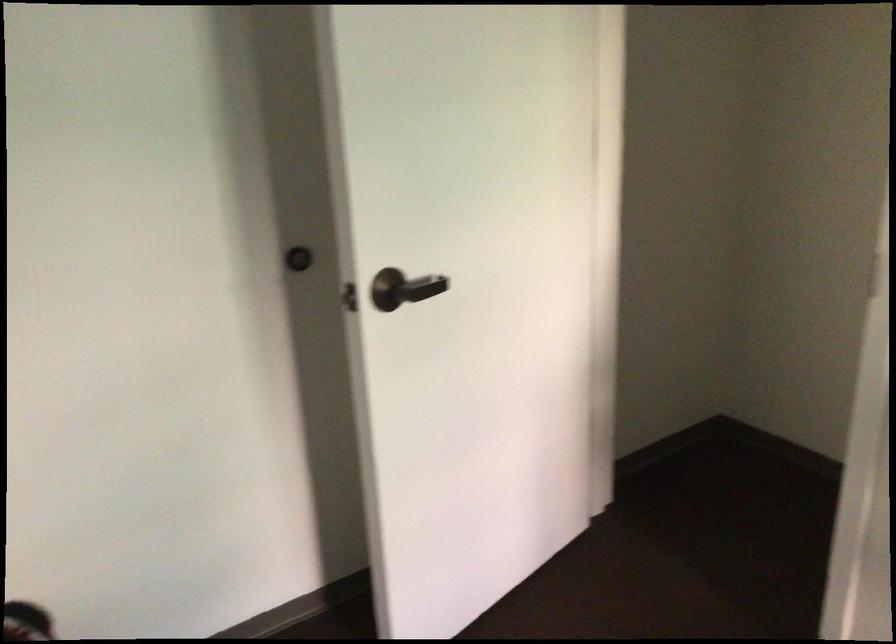
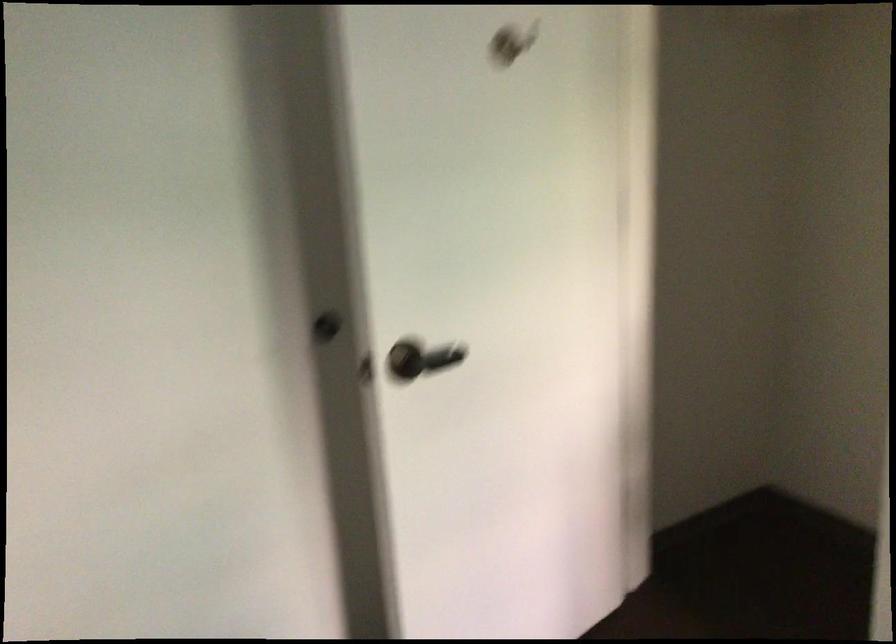
Find the pixel in the second image that matches the point at 390,285 in the first image.

(407, 359)